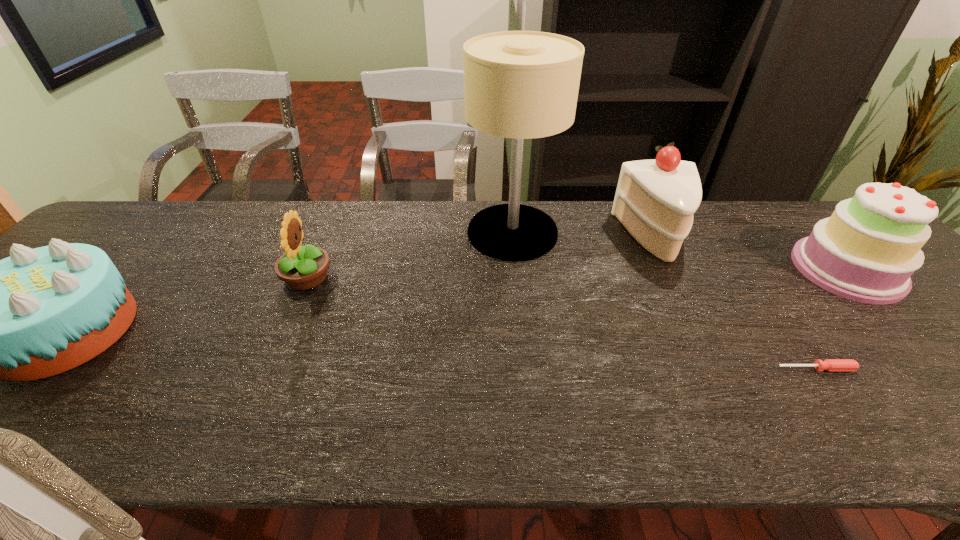
Where is `free space between the fourth object from left to right and the table lamp`? Image resolution: width=960 pixels, height=540 pixels. free space between the fourth object from left to right and the table lamp is located at coordinates (585, 234).

At what (x,y) coordinates should I click in order to perform the action: click on free space that is in between the tallest object and the second object from right to left. Please return your answer as a coordinate pair (x, y). This screenshot has height=540, width=960. Looking at the image, I should click on (664, 301).

Image resolution: width=960 pixels, height=540 pixels. I want to click on vacant region between the screwdriver and the rightmost object, so click(x=831, y=319).

The image size is (960, 540). Identify the location of vacant area between the third object from left to right and the second object from left to right. (410, 255).

Where is `free space that is in between the third object from right to left and the sunflower`? free space that is in between the third object from right to left and the sunflower is located at coordinates (482, 258).

Image resolution: width=960 pixels, height=540 pixels. What are the coordinates of `empty space that is in between the shortest object and the fourth object from left to right` in the screenshot? It's located at (736, 302).

Locate an element on the screen. The image size is (960, 540). vacant area that lies between the screwdriver and the sunflower is located at coordinates (562, 323).

Identify the location of the fourth closest object to the second object from left to right. The height and width of the screenshot is (540, 960). (832, 365).

Where is `the fifth closest object to the shortest object`? Image resolution: width=960 pixels, height=540 pixels. the fifth closest object to the shortest object is located at coordinates (40, 312).

This screenshot has width=960, height=540. What are the coordinates of `cake that is the third closest to the tallest object` in the screenshot? It's located at (40, 312).